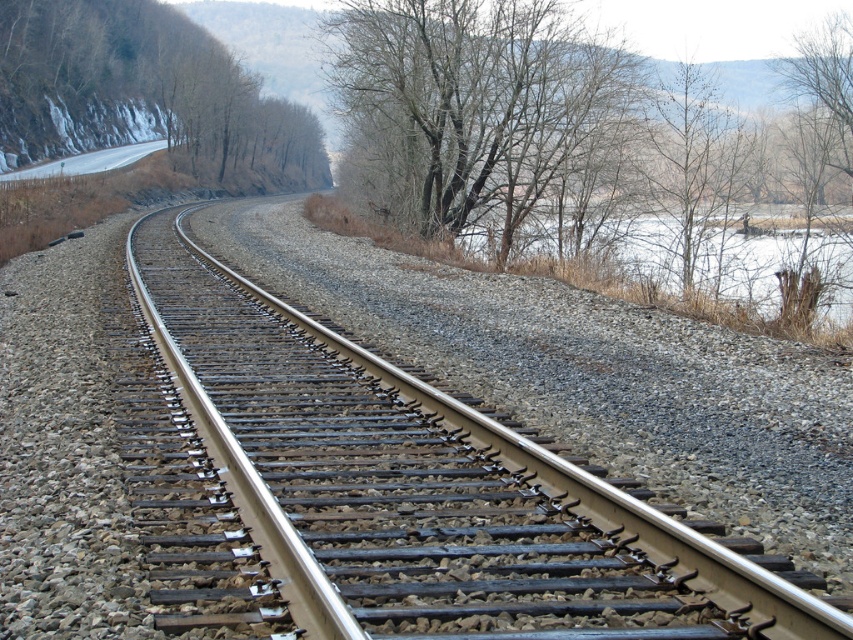
Question: Does bare branches at upper center have a larger size compared to bare wood trees at upper left?

Choices:
 (A) no
 (B) yes

Answer: (A)

Question: Which point is farther from the camera taking this photo?

Choices:
 (A) (601, 282)
 (B) (260, 184)

Answer: (B)

Question: Can you confirm if bare wood trees at upper left is positioned to the left of gray gravel lake at upper right?

Choices:
 (A) yes
 (B) no

Answer: (A)

Question: Which point is closer to the camera?

Choices:
 (A) (97, 109)
 (B) (373, 369)
 (C) (425, 67)

Answer: (B)

Question: Is bare wood trees at upper left bigger than gray gravel lake at upper right?

Choices:
 (A) yes
 (B) no

Answer: (A)

Question: Which object is closer to the camera taking this photo?

Choices:
 (A) bare branches at upper center
 (B) metal/smooth track at center

Answer: (B)